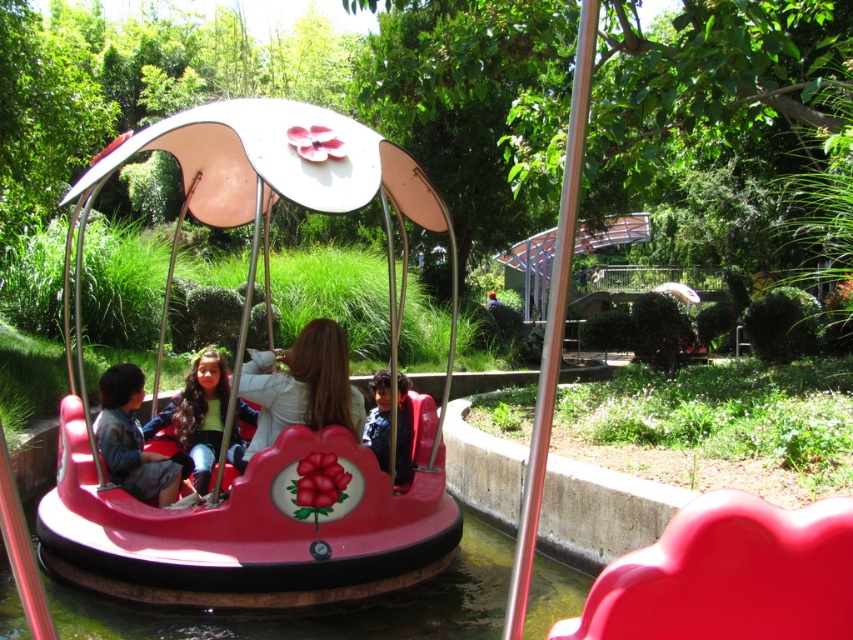
You are a photographer trying to capture both the matte white jacket at center and the denim jacket at left in a single shot. Since you want both jackets to appear clearly in the photo, which jacket should you focus on to ensure the larger one is sharp?

The matte white jacket at center is larger than the denim jacket at left, so you should focus on the matte white jacket at center to ensure it appears sharp in the photo.

You are standing at the entrance of the theme park and want to locate the shiny plastic bumper car at center. According to the coordinate system where the bottom left corner is the origin, can you tell me its position?

The shiny plastic bumper car at center is located at point (260, 525) in the coordinate system.